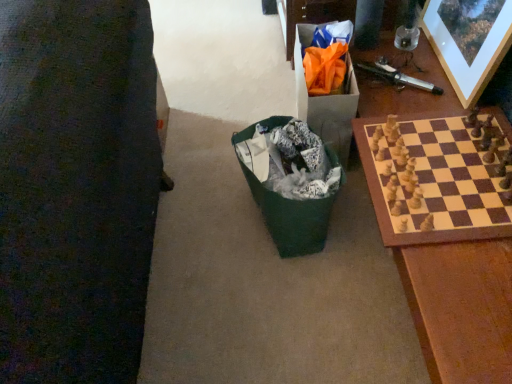
Question: Does orange paper bag at upper right have a lesser height compared to wooden picture frame at upper right?

Choices:
 (A) no
 (B) yes

Answer: (B)

Question: Could you tell me if orange paper bag at upper right is turned towards wooden picture frame at upper right?

Choices:
 (A) yes
 (B) no

Answer: (B)

Question: Is orange paper bag at upper right far away from wooden picture frame at upper right?

Choices:
 (A) no
 (B) yes

Answer: (A)

Question: Does orange paper bag at upper right have a greater width compared to wooden picture frame at upper right?

Choices:
 (A) no
 (B) yes

Answer: (B)

Question: From the image's perspective, is orange paper bag at upper right located above wooden picture frame at upper right?

Choices:
 (A) no
 (B) yes

Answer: (A)

Question: From a real-world perspective, is green fabric bag at center positioned above or below wooden picture frame at upper right?

Choices:
 (A) above
 (B) below

Answer: (B)

Question: Considering the relative positions of green fabric bag at center and wooden picture frame at upper right in the image provided, is green fabric bag at center to the left or to the right of wooden picture frame at upper right?

Choices:
 (A) left
 (B) right

Answer: (A)

Question: Looking at their shapes, would you say green fabric bag at center is wider or thinner than wooden picture frame at upper right?

Choices:
 (A) wide
 (B) thin

Answer: (A)

Question: Does point (304, 216) appear closer or farther from the camera than point (485, 69)?

Choices:
 (A) farther
 (B) closer

Answer: (B)

Question: Would you say wooden picture frame at upper right is to the left or to the right of wooden chess set at right in the picture?

Choices:
 (A) right
 (B) left

Answer: (A)

Question: Considering the positions of point (442, 6) and point (433, 233), is point (442, 6) closer or farther from the camera than point (433, 233)?

Choices:
 (A) closer
 (B) farther

Answer: (B)

Question: In terms of height, does wooden picture frame at upper right look taller or shorter compared to wooden chess set at right?

Choices:
 (A) tall
 (B) short

Answer: (A)

Question: Which is correct: wooden picture frame at upper right is inside wooden chess set at right, or outside of it?

Choices:
 (A) outside
 (B) inside

Answer: (A)

Question: From the image's perspective, is wooden chess set at right positioned above or below orange paper bag at upper right?

Choices:
 (A) above
 (B) below

Answer: (B)

Question: Does point (466, 233) appear closer or farther from the camera than point (304, 114)?

Choices:
 (A) closer
 (B) farther

Answer: (A)